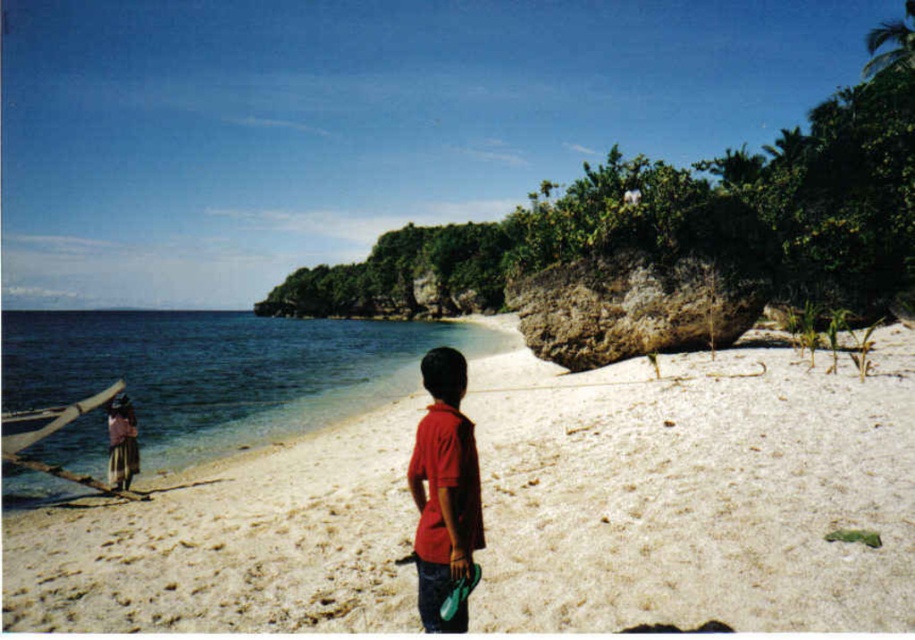
Question: Among these points, which one is nearest to the camera?

Choices:
 (A) (421, 454)
 (B) (89, 387)
 (C) (639, 602)

Answer: (A)

Question: Can you confirm if white sandy beach at center is positioned above brown woven fabric at left?

Choices:
 (A) no
 (B) yes

Answer: (B)

Question: Among these points, which one is farthest from the camera?

Choices:
 (A) (138, 310)
 (B) (460, 486)
 (C) (120, 408)
 (D) (346, 509)

Answer: (A)

Question: Does red matte shirt at center appear on the right side of brown woven fabric at left?

Choices:
 (A) no
 (B) yes

Answer: (B)

Question: Which object is the closest to the brown woven fabric at left?

Choices:
 (A) clear blue water at lower left
 (B) white sandy beach at center

Answer: (B)

Question: Does clear blue water at lower left come in front of brown woven fabric at left?

Choices:
 (A) no
 (B) yes

Answer: (A)